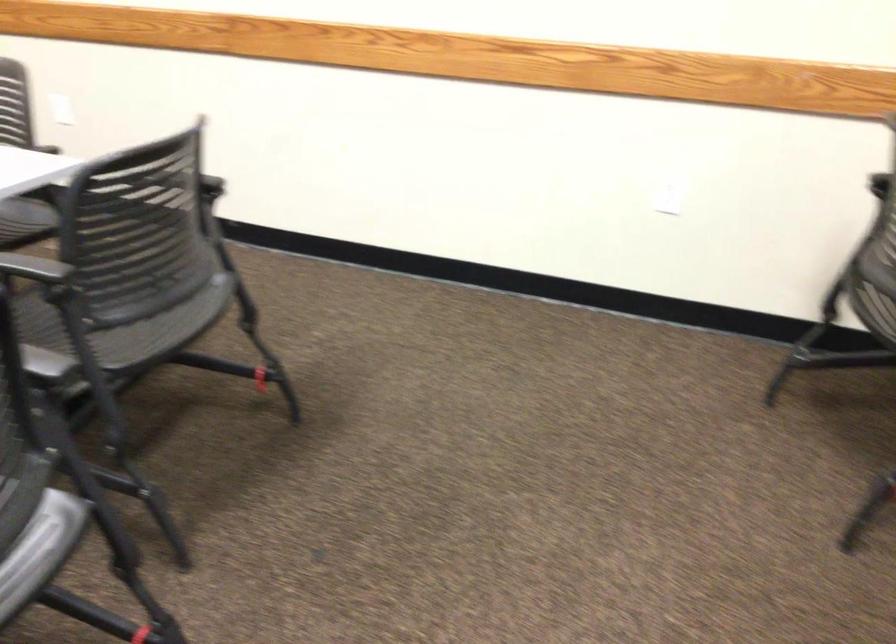
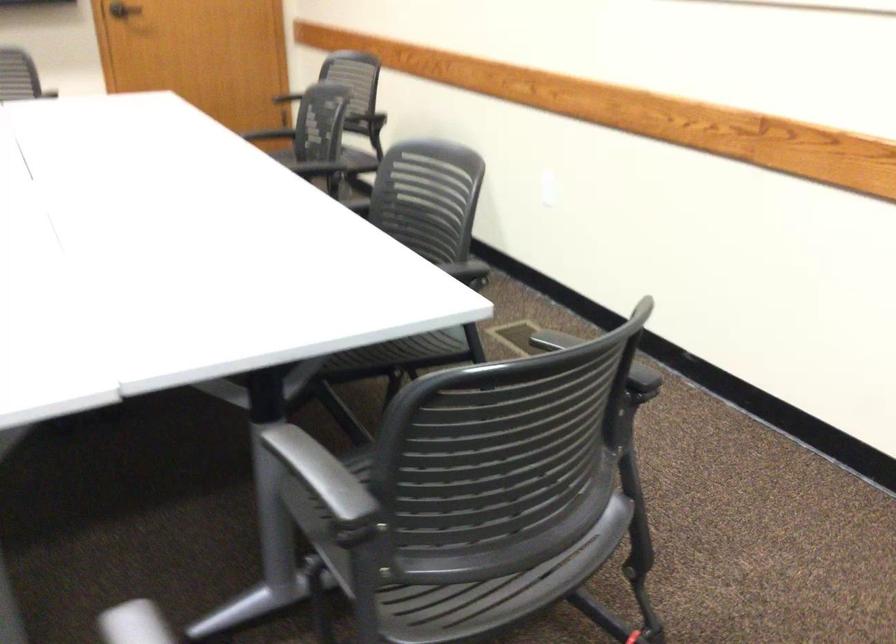
The point at (169, 337) is marked in the first image. Where is the corresponding point in the second image?

(496, 590)